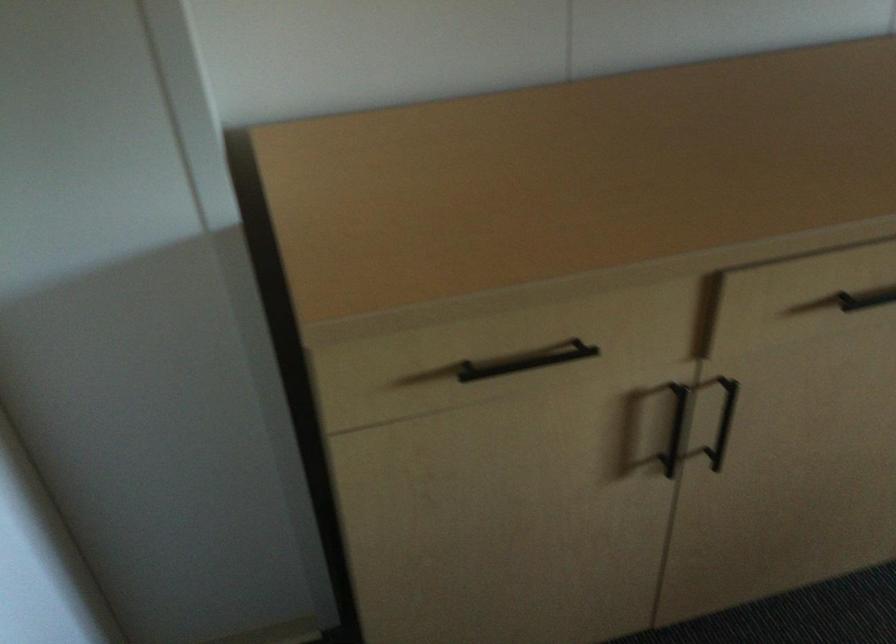
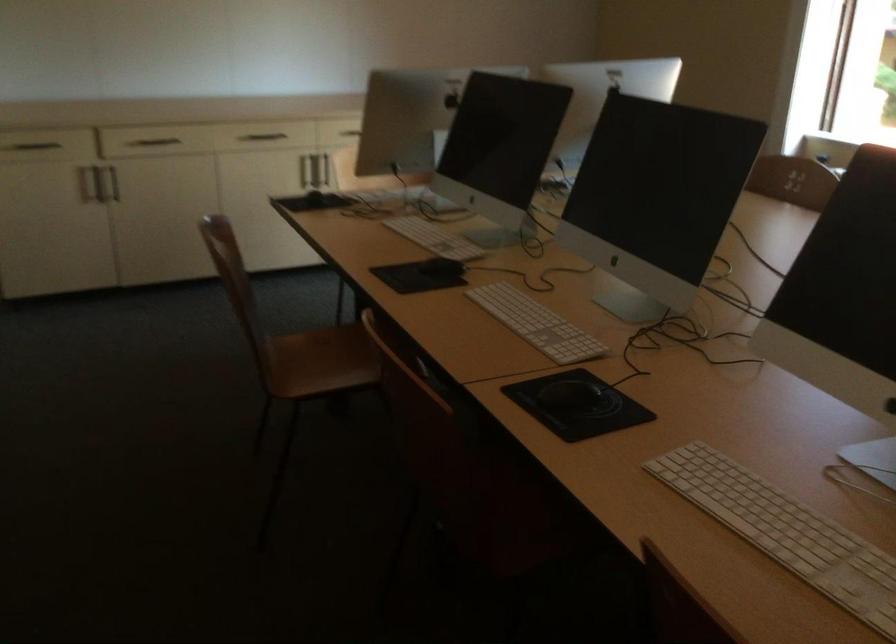
In a continuous first-person perspective shot, in which direction is the camera moving?

The cameraman walked toward right, backward.